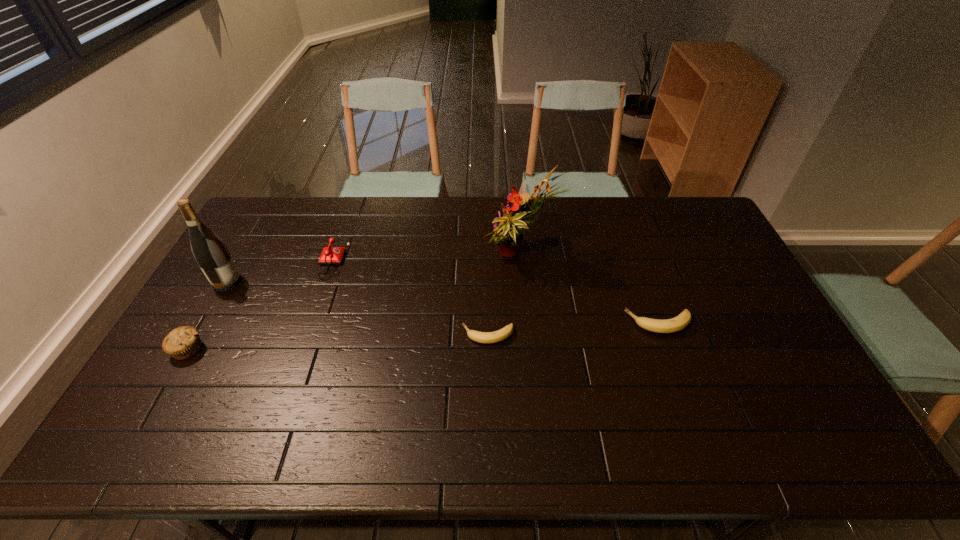
What are the coordinates of `vacant space located 0.180m on the right of the fourth shortest object` in the screenshot? It's located at (269, 349).

Where is `object situated at the far edge`? The width and height of the screenshot is (960, 540). object situated at the far edge is located at coordinates [508, 229].

Locate an element on the screen. This screenshot has width=960, height=540. wine bottle present at the left edge is located at coordinates (210, 252).

Find the location of a particular element. muffin positioned at the left edge is located at coordinates (183, 342).

Where is `free space at the far edge`? free space at the far edge is located at coordinates (431, 203).

Where is `free spot at the near edge of the desktop`? The image size is (960, 540). free spot at the near edge of the desktop is located at coordinates (652, 393).

At what (x,y) coordinates should I click in order to perform the action: click on vacant area at the left edge of the desktop. Please return your answer as a coordinate pair (x, y). This screenshot has height=540, width=960. Looking at the image, I should click on coord(189,363).

In the image, there is a desktop. Identify the location of vacant area at the right edge. This screenshot has height=540, width=960. (700, 258).

Image resolution: width=960 pixels, height=540 pixels. I want to click on vacant space at the far right corner of the desktop, so click(684, 200).

This screenshot has height=540, width=960. What are the coordinates of `vacant region between the fourth shortest object and the bouquet` in the screenshot? It's located at (354, 303).